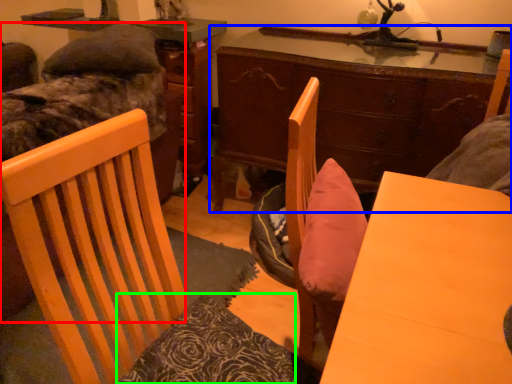
Question: Which object is the closest to the bed (highlighted by a red box)? Choose among these: desk (highlighted by a blue box) or pillow (highlighted by a green box).

Choices:
 (A) desk
 (B) pillow

Answer: (A)